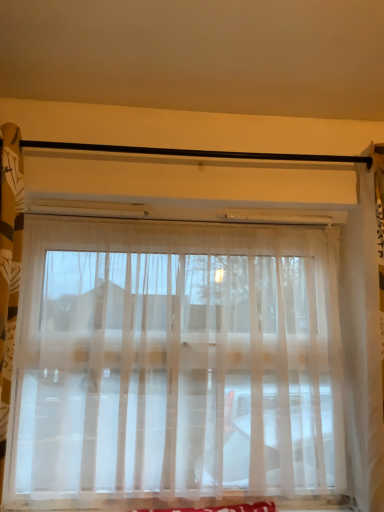
The width and height of the screenshot is (384, 512). What do you see at coordinates (220, 508) in the screenshot?
I see `white sheer fabric at lower center` at bounding box center [220, 508].

In order to face white sheer fabric at lower center, should I rotate leftwards or rightwards?

Turn left approximately 0.359 degrees to face it.

What is the approximate height of white sheer fabric at lower center?

The height of white sheer fabric at lower center is 1.77 inches.

Where is `white sheer fabric at lower center`? The height and width of the screenshot is (512, 384). white sheer fabric at lower center is located at coordinates [220, 508].

Image resolution: width=384 pixels, height=512 pixels. I want to click on white sheer fabric at lower center, so [220, 508].